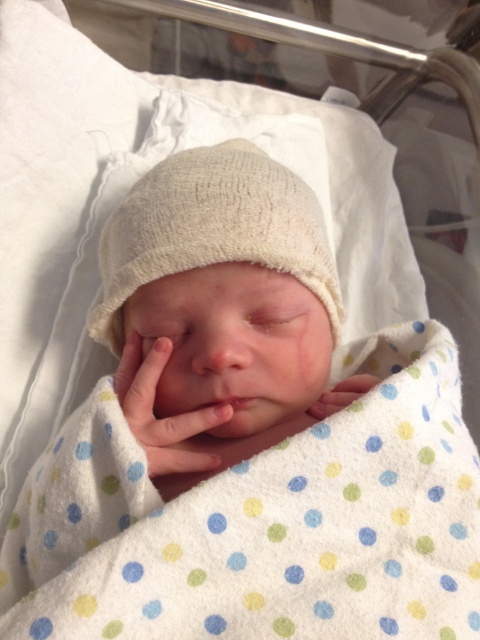
Who is more distant from viewer, (242, 252) or (128, 337)?

The point (128, 337) is more distant.

How distant is white knitted hat at center from soft white knit at center?

white knitted hat at center and soft white knit at center are 6.36 inches apart.

Does point (319, 291) come in front of point (126, 376)?

No, it is not.

Where is `white knitted hat at center`? Image resolution: width=480 pixels, height=640 pixels. white knitted hat at center is located at coordinates (213, 228).

Consider the image. Between white knitted hat at center and smooth skin hand at center, which one has less height?

With less height is smooth skin hand at center.

Between point (173, 221) and point (336, 394), which one is positioned in front?

Point (173, 221)

Is point (299, 236) closer to viewer compared to point (327, 396)?

Yes, point (299, 236) is in front of point (327, 396).

Where is `white knitted hat at center`? This screenshot has height=640, width=480. white knitted hat at center is located at coordinates (213, 228).

Looking at this image, does soft white knit at center have a lesser width compared to smooth skin hand at center?

In fact, soft white knit at center might be wider than smooth skin hand at center.

Who is more forward, (168, 444) or (325, 403)?

Positioned in front is point (168, 444).

Locate an element on the screen. The width and height of the screenshot is (480, 640). soft white knit at center is located at coordinates (162, 417).